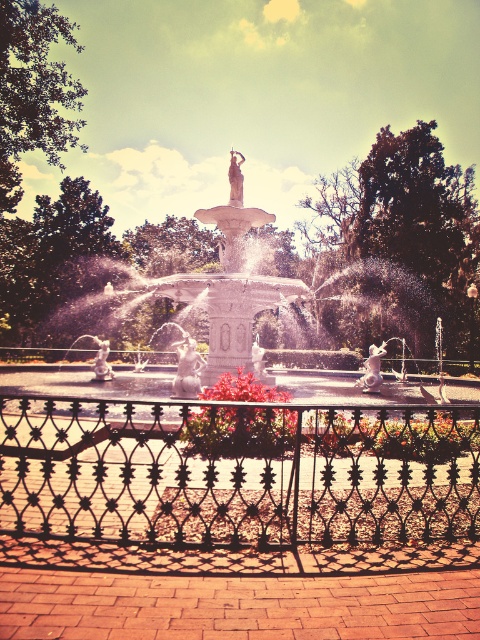
Question: Is black wrought iron fence at center thinner than vivid red petals at center?

Choices:
 (A) yes
 (B) no

Answer: (A)

Question: Which point appears farthest from the camera in this image?

Choices:
 (A) (350, 480)
 (B) (210, 392)

Answer: (B)

Question: Can you confirm if black wrought iron fence at center is positioned below vivid red petals at center?

Choices:
 (A) yes
 (B) no

Answer: (A)

Question: Does black wrought iron fence at center have a larger size compared to vivid red petals at center?

Choices:
 (A) yes
 (B) no

Answer: (B)

Question: Which point is closer to the camera taking this photo?

Choices:
 (A) (x=314, y=525)
 (B) (x=284, y=412)

Answer: (A)